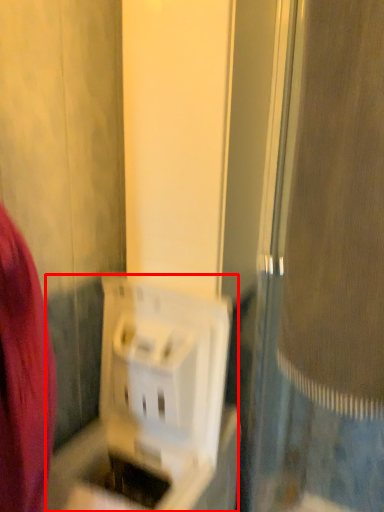
Question: From the image's perspective, considering the relative positions of appliance (annotated by the red box) and screen door in the image provided, where is appliance (annotated by the red box) located with respect to the staircase?

Choices:
 (A) below
 (B) above

Answer: (A)